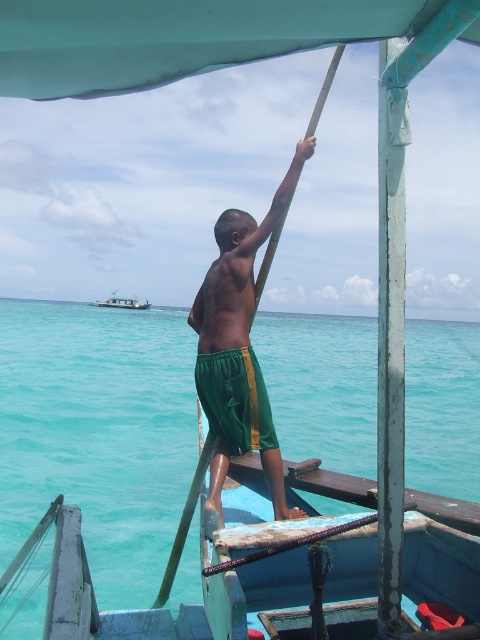
Question: Can you confirm if turquoise water at center is thinner than teal painted wood pole at right?

Choices:
 (A) yes
 (B) no

Answer: (B)

Question: Which object is the farthest from the turquoise water at center?

Choices:
 (A) teal fabric canopy at upper center
 (B) green fabric shorts at center

Answer: (B)

Question: Which object is the farthest from the white plastic boat at upper left?

Choices:
 (A) teal painted wood pole at right
 (B) turquoise water at center
 (C) teal fabric canopy at upper center
 (D) green fabric shorts at center

Answer: (C)

Question: Does turquoise water at center appear on the left side of teal fabric canopy at upper center?

Choices:
 (A) no
 (B) yes

Answer: (B)

Question: Which of the following is the closest to the observer?

Choices:
 (A) (63, 97)
 (B) (377, 620)
 (C) (145, 304)

Answer: (A)

Question: Is teal fabric canopy at upper center to the left of teal painted wood pole at right from the viewer's perspective?

Choices:
 (A) no
 (B) yes

Answer: (B)